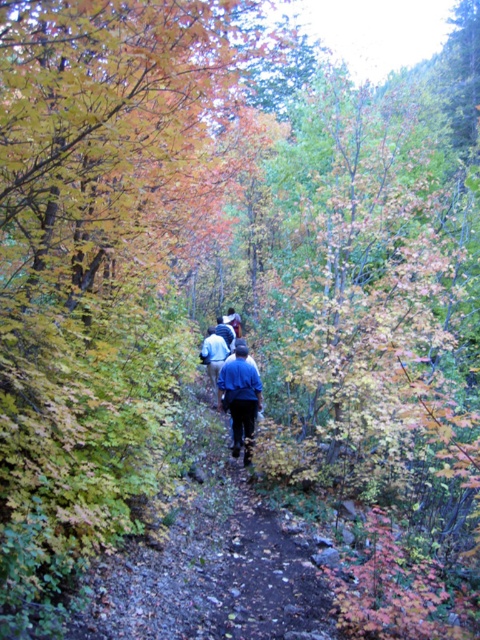
Question: Which point is closer to the camera taking this photo?

Choices:
 (A) (216, 371)
 (B) (232, 397)

Answer: (B)

Question: Among these objects, which one is farthest from the camera?

Choices:
 (A) blue denim jacket at center
 (B) blue fabric jacket at center

Answer: (B)

Question: Is blue denim jacket at center positioned at the back of blue fabric jacket at center?

Choices:
 (A) yes
 (B) no

Answer: (B)

Question: Is the position of blue denim jacket at center more distant than that of blue fabric jacket at center?

Choices:
 (A) no
 (B) yes

Answer: (A)

Question: Can you confirm if blue denim jacket at center is positioned below blue fabric jacket at center?

Choices:
 (A) no
 (B) yes

Answer: (B)